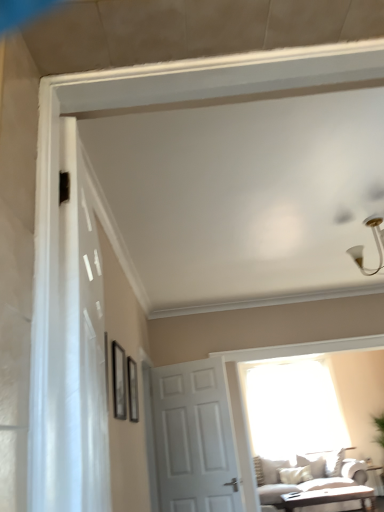
Question: From their relative heights in the image, would you say light brown wooden coffee table at lower right, which is the second table from back to front, is taller or shorter than white glossy light fixture at upper right?

Choices:
 (A) tall
 (B) short

Answer: (B)

Question: In the image, is light brown wooden coffee table at lower right, the 1th table when ordered from front to back, positioned in front of or behind white glossy light fixture at upper right?

Choices:
 (A) front
 (B) behind

Answer: (B)

Question: Estimate the real-world distances between objects in this image. Which object is farther from the matte black picture frame at upper left, which appears as the second picture frame when viewed from the back?

Choices:
 (A) white sheer curtain at left
 (B) white glossy table at lower right, the first table positioned from the right
 (C) matte black picture frame at upper center, the 2th picture frame when ordered from front to back
 (D) white glossy light fixture at upper right
 (E) white matte door at center

Answer: (B)

Question: Which of these objects is positioned closest to the white glossy light fixture at upper right?

Choices:
 (A) matte black picture frame at upper center, arranged as the first picture frame when viewed from the back
 (B) transparent glass window at center
 (C) white glossy table at lower right, placed as the 2th table when sorted from front to back
 (D) white matte door at center
 (E) light brown wooden coffee table at lower right, the 1th table when ordered from left to right

Answer: (A)